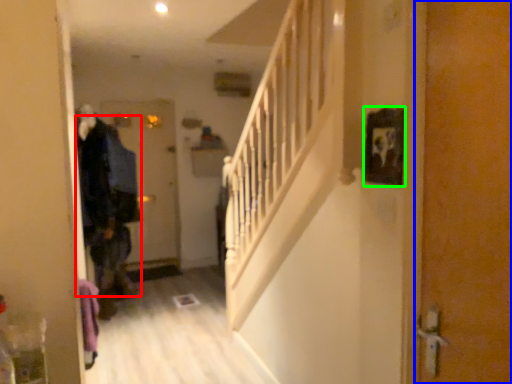
Question: Based on their relative distances, which object is farther from clothing (highlighted by a red box)? Choose from door (highlighted by a blue box) and picture frame (highlighted by a green box).

Choices:
 (A) door
 (B) picture frame

Answer: (A)